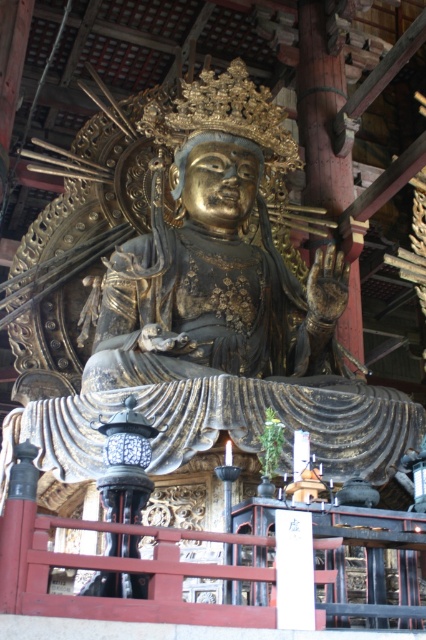
Can you confirm if gold/bronze statue at center is smaller than gold/gilded statue at center?

Actually, gold/bronze statue at center might be larger than gold/gilded statue at center.

Does point (111, 244) lie in front of point (149, 333)?

No.

I want to click on gold/bronze statue at center, so click(x=204, y=308).